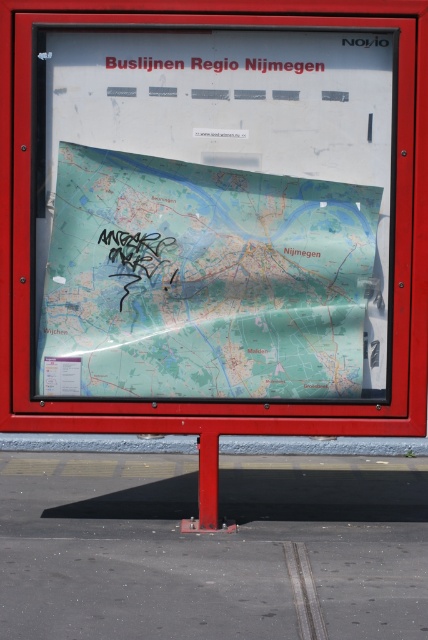
You are a city planner reviewing the public information board. You notice two items on the board. The transparent plastic map at center and the black paper at upper center. Which one is taller?

The transparent plastic map at center is taller than the black paper at upper center.

Please describe the exact location of the transparent plastic map at center on the image coordinate system where the origin is at the bottom left corner of the image. Use the coordinate system with x and y values between 0 and 1. Please use the format of x,y.

The transparent plastic map at center is located at coordinate point (204, 282).

You are a city planner reviewing the public information board. You notice the transparent plastic map at center and the black paper at upper center. Which object is closer to the top of the board?

The black paper at upper center is closer to the top of the board because it is positioned above the transparent plastic map at center.